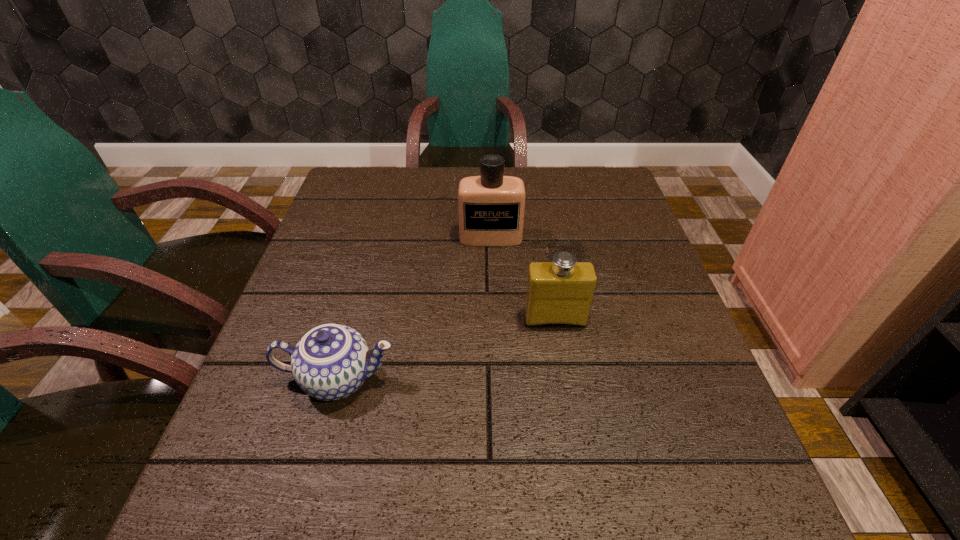
The height and width of the screenshot is (540, 960). Identify the location of vacant region at the left edge of the desktop. point(316,400).

The width and height of the screenshot is (960, 540). Find the location of `vacant area at the right edge of the desktop`. vacant area at the right edge of the desktop is located at coordinates (722, 448).

The width and height of the screenshot is (960, 540). In the image, there is a desktop. What are the coordinates of `free space at the near left corner` in the screenshot? It's located at (245, 501).

At what (x,y) coordinates should I click in order to perform the action: click on vacant space at the near right corner of the desktop. Please return your answer as a coordinate pair (x, y). Image resolution: width=960 pixels, height=540 pixels. Looking at the image, I should click on (668, 492).

This screenshot has width=960, height=540. I want to click on unoccupied position between the chinaware and the farthest object, so click(x=415, y=308).

Find the location of a particular element. The width and height of the screenshot is (960, 540). free space that is in between the nearest object and the farther perfume is located at coordinates (415, 308).

Identify the location of vacant area that lies between the nearer perfume and the farther perfume. (523, 278).

Locate an element on the screen. The width and height of the screenshot is (960, 540). empty location between the farther perfume and the nearer perfume is located at coordinates (523, 278).

The height and width of the screenshot is (540, 960). I want to click on free space between the nearest object and the second farthest object, so pyautogui.click(x=446, y=349).

Where is `vacant space in between the second nearest object and the chinaware`? vacant space in between the second nearest object and the chinaware is located at coordinates (446, 349).